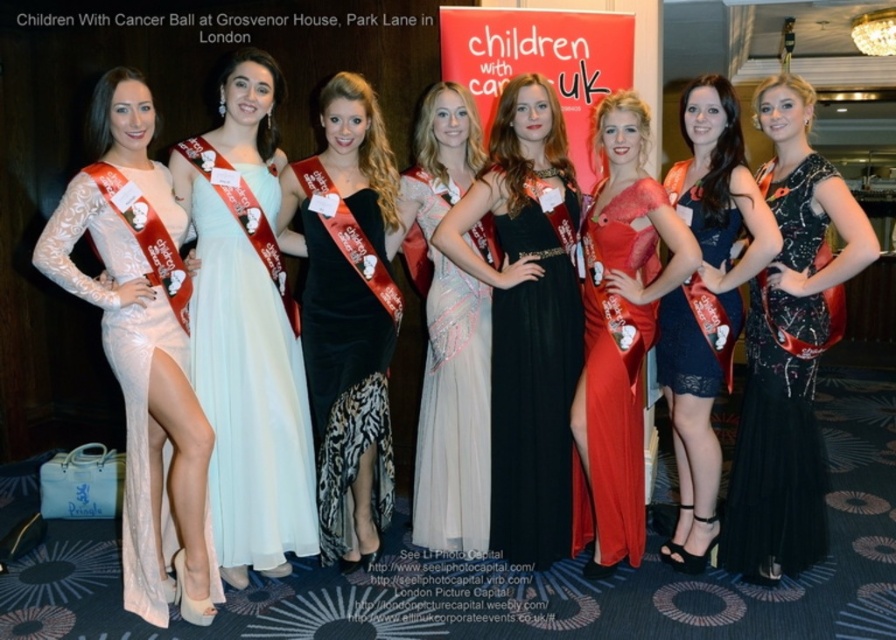
Can you confirm if light blue satin dress at left is bigger than velvet black dress at center?

Indeed, light blue satin dress at left has a larger size compared to velvet black dress at center.

Does light blue satin dress at left appear on the right side of velvet black dress at center?

In fact, light blue satin dress at left is to the left of velvet black dress at center.

Is point (211, 234) closer to viewer compared to point (332, 545)?

That is True.

The image size is (896, 640). Identify the location of light blue satin dress at left. (247, 330).

Is pearl lace dress at left closer to camera compared to pearl lace dress at center?

That is True.

Can you confirm if pearl lace dress at left is taller than pearl lace dress at center?

Correct, pearl lace dress at left is much taller as pearl lace dress at center.

What are the coordinates of `pearl lace dress at left` in the screenshot? It's located at (142, 348).

Is pearl lace dress at left to the left of lace dress at center from the viewer's perspective?

Yes, pearl lace dress at left is to the left of lace dress at center.

Is point (161, 595) more distant than point (737, 128)?

No, (161, 595) is in front of (737, 128).

What are the coordinates of `pearl lace dress at left` in the screenshot? It's located at (142, 348).